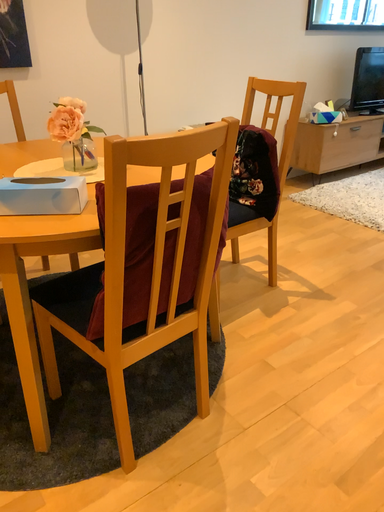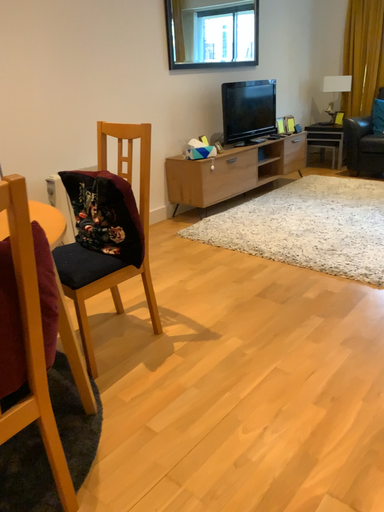
Question: How did the camera likely rotate when shooting the video?

Choices:
 (A) rotated left
 (B) rotated right

Answer: (B)